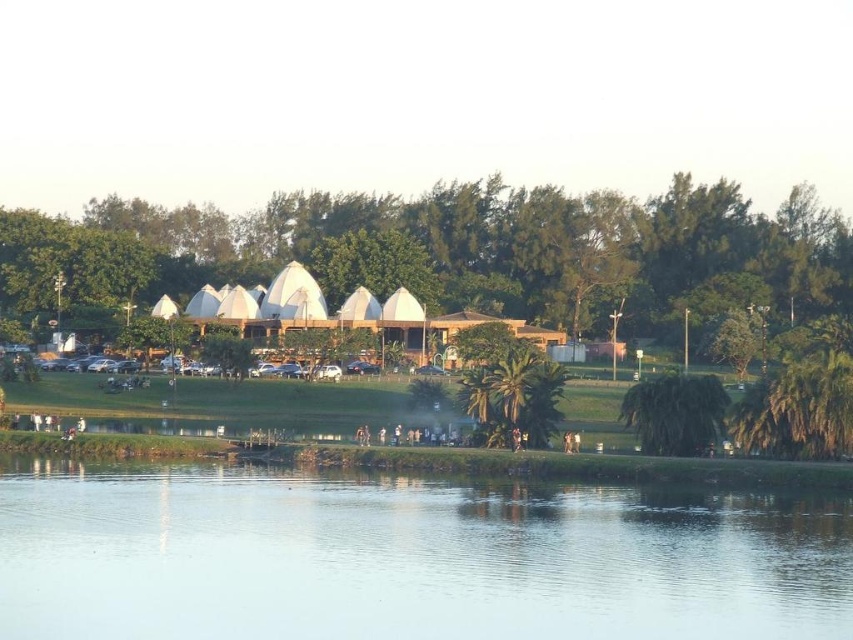
You are planning to take a photo of the transparent water at center and the green leafy palm tree at center from the lakeside. Which object will occupy more space in your photo?

The transparent water at center will occupy more space in your photo since it has a larger size compared to the green leafy palm tree at center.

You are planning to set up a picnic blanket in the grassy area near the green leafy tree at lower right. Considering the position of the green leafy tree at center, will its shadow fall on your picnic area during the late afternoon or evening? Please explain your reasoning.

The green leafy tree at center is much taller than the green leafy tree at lower right. Since the sun is low in the sky during late afternoon or evening, the taller tree will cast a longer shadow. Therefore, the shadow from the green leafy tree at center may extend over the picnic area near the green leafy tree at lower right, potentially blocking sunlight.

You are planning to set up a picnic blanket between the green leafy tree at center and the green leafy palm tree at center. The picnic blanket is 200 feet long. Will it reach from one tree to the other?

The distance between the green leafy tree at center and the green leafy palm tree at center is 199.81 feet, so the 200 feet long picnic blanket will be sufficient to reach from one tree to the other.